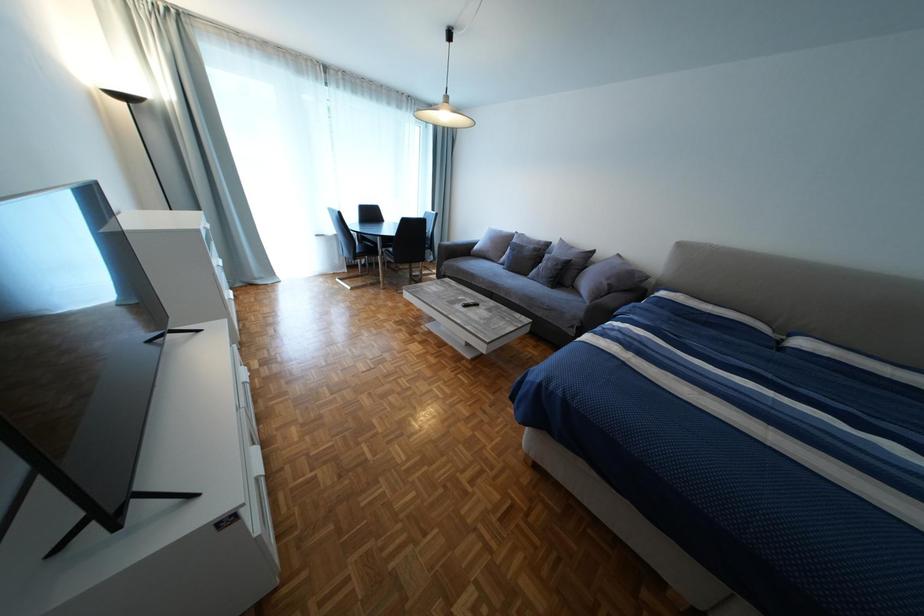
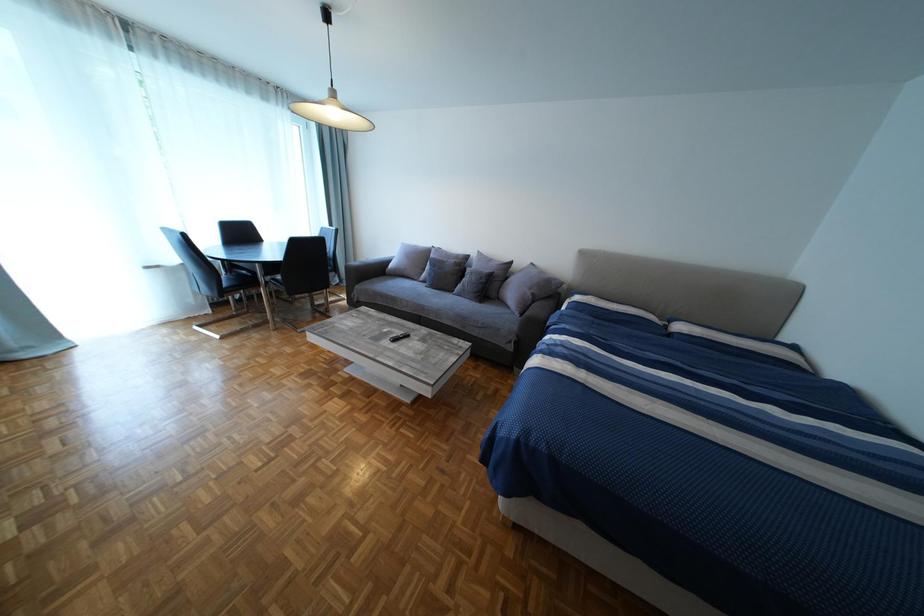
Question: The images are taken continuously from a first-person perspective. In which direction is your viewpoint rotating?

Choices:
 (A) Left
 (B) Right
 (C) Up
 (D) Down

Answer: (B)